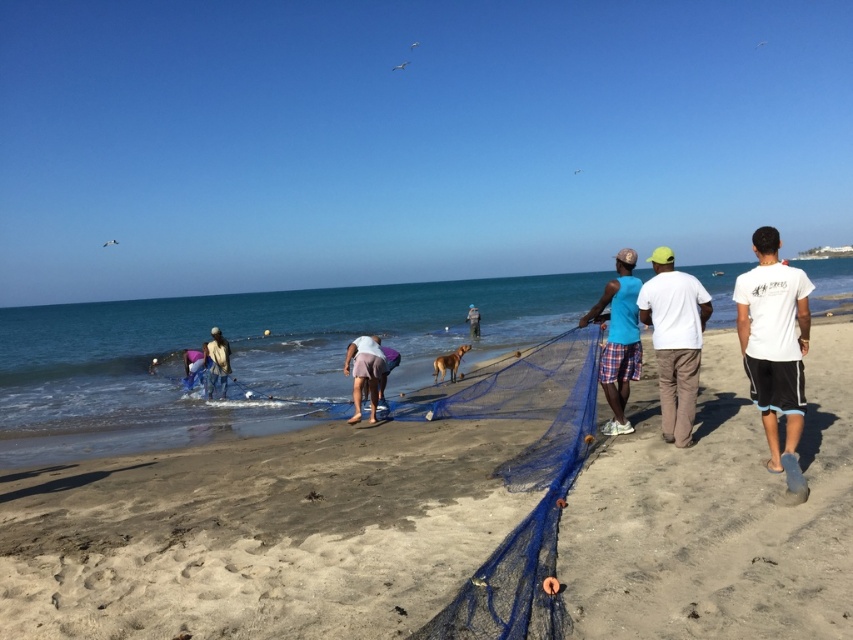
Does point (373, 346) come in front of point (184, 355)?

That is True.

Does light pink fabric shorts at center have a smaller size compared to blue fabric at lower left?

Yes.

Who is more distant from viewer, [357,413] or [184,372]?

The point [184,372] is behind.

Identify the location of light pink fabric shorts at center. (364, 372).

Is blue mesh net at center bigger than blue fabric at lower left?

Yes.

Can you confirm if blue mesh net at center is smaller than blue fabric at lower left?

Incorrect, blue mesh net at center is not smaller in size than blue fabric at lower left.

Identify the location of blue mesh net at center. (257, 534).

Image resolution: width=853 pixels, height=640 pixels. What do you see at coordinates (216, 364) in the screenshot?
I see `light brown fabric jacket at lower left` at bounding box center [216, 364].

Does light brown fabric jacket at lower left have a smaller size compared to blue fabric at lower left?

Actually, light brown fabric jacket at lower left might be larger than blue fabric at lower left.

Find the location of a particular element. light brown fabric jacket at lower left is located at coordinates (216, 364).